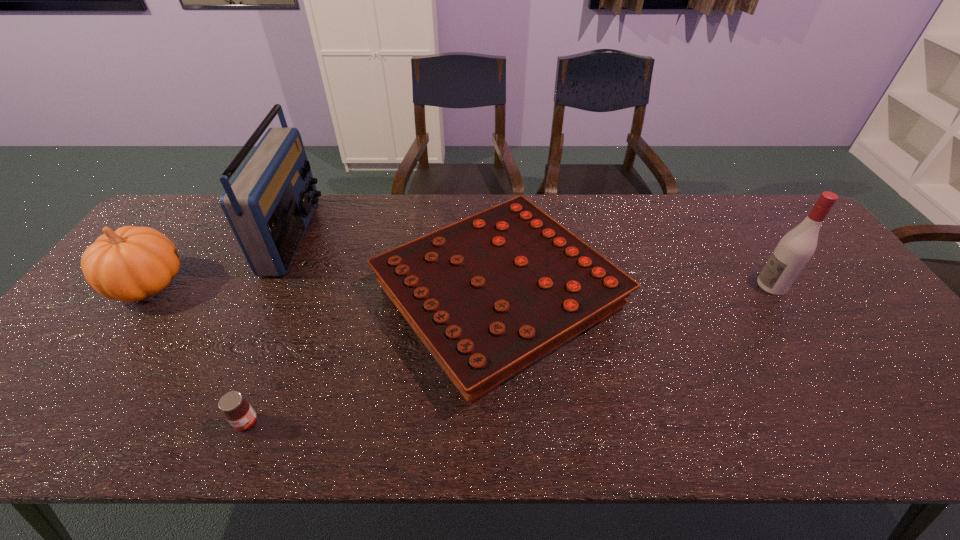
Find the location of a particular element. This screenshot has height=540, width=960. vacant space located on the back of the pumpkin is located at coordinates (199, 215).

Identify the location of vacant space situated on the left of the gameboard. (237, 296).

Where is `radio receiver present at the far edge`? radio receiver present at the far edge is located at coordinates (269, 203).

Find the location of a particular element. The image size is (960, 540). gameboard at the far edge is located at coordinates (489, 295).

Where is `gameboard that is at the near edge`? The image size is (960, 540). gameboard that is at the near edge is located at coordinates (489, 295).

Where is `jam that is at the near edge`? Image resolution: width=960 pixels, height=540 pixels. jam that is at the near edge is located at coordinates (238, 412).

The width and height of the screenshot is (960, 540). Identify the location of object that is at the left edge. (132, 263).

In the image, there is a desktop. In order to click on vacant space at the far edge in this screenshot , I will do `click(658, 215)`.

Identify the location of free region at the near edge of the desktop. (682, 424).

In order to click on unoccupied area between the second object from right to left and the pumpkin in this screenshot , I will do `click(324, 291)`.